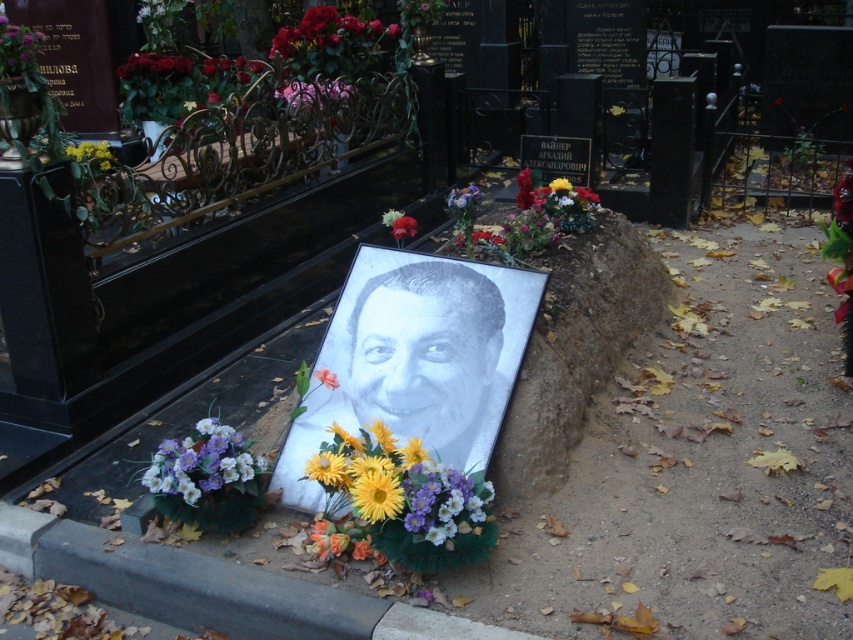
You are standing at the center of the cemetery and want to place a new bouquet of flowers. The smooth white portrait at center is represented by point (421, 362). Where should you place the bouquet so that it is directly to the left of the smooth white portrait at center?

Place the bouquet at coordinates 0.567 minus some value, 0.494 to be directly left of the smooth white portrait at center.

You are standing at the cemetery looking at the grave site. There are two points marked on the ground near the grave. The first point is at coordinates point (381, 516) and the second point is at point (334, 378). Which point is closer to you?

The point at coordinates point (381, 516) is closer to you than the point at point (334, 378).

You are a florist who needs to arrange two flowers, the purple paper flower at center and the yellow fabric flower at center, in a way that follows the cemetery scene. Which flower should be placed in a more prominent position to match the scene?

The purple paper flower at center should be placed in a more prominent position since it is larger than the yellow fabric flower at center in the scene.